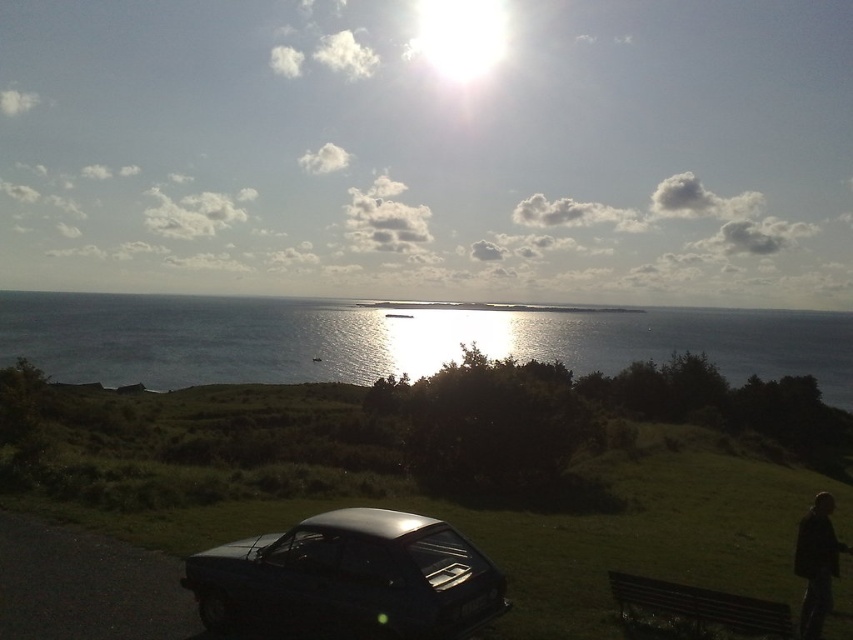
Is shiny black car at lower center positioned behind dark brown wooden bench at lower right?

No, shiny black car at lower center is in front of dark brown wooden bench at lower right.

The image size is (853, 640). I want to click on shiny black car at lower center, so click(x=349, y=579).

Is point (587, 496) less distant than point (584, 314)?

Yes, point (587, 496) is in front of point (584, 314).

Identify the location of shiny metallic car at center. The height and width of the screenshot is (640, 853). (447, 497).

The width and height of the screenshot is (853, 640). What do you see at coordinates (393, 339) in the screenshot? I see `blue water at center` at bounding box center [393, 339].

Can you confirm if blue water at center is positioned above shiny black car at lower center?

Yes.

Is point (161, 349) positioned in front of point (374, 611)?

No.

Find the location of a particular element. This screenshot has height=640, width=853. blue water at center is located at coordinates (393, 339).